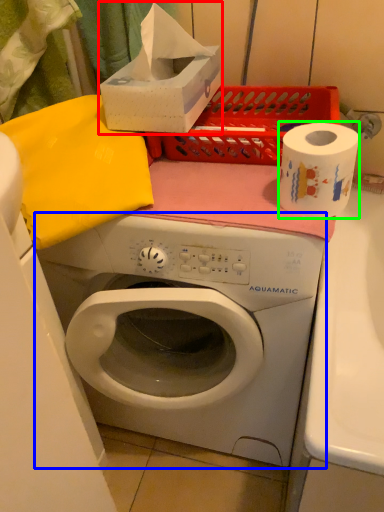
Question: Estimate the real-world distances between objects in this image. Which object is closer to box (highlighted by a red box), washing machine (highlighted by a blue box) or paper towel (highlighted by a green box)?

Choices:
 (A) washing machine
 (B) paper towel

Answer: (B)